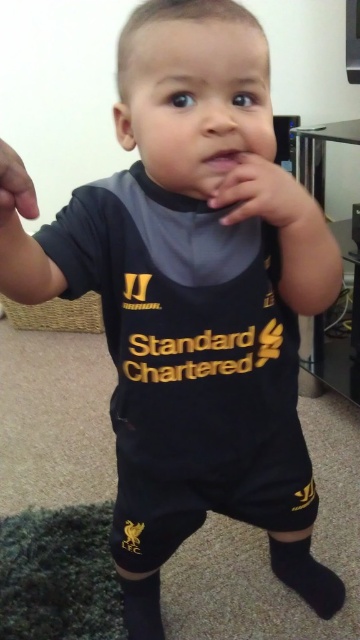
Does matte black hand at center appear on the left side of matte black hand at left?

No, matte black hand at center is not to the left of matte black hand at left.

You are a GUI agent. You are given a task and a screenshot of the screen. Output one action in this format:
    pyautogui.click(x=<x>, y=<y>)
    Task: Click on the matte black hand at center
    The width and height of the screenshot is (360, 640).
    Given the screenshot: What is the action you would take?
    click(x=266, y=196)

Locate an element on the screen. Image resolution: width=360 pixels, height=640 pixels. matte black hand at center is located at coordinates (266, 196).